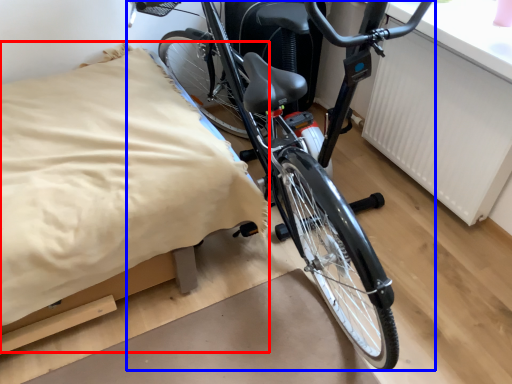
Question: Among these objects, which one is farthest to the camera, sheet (highlighted by a red box) or bicycle (highlighted by a blue box)?

Choices:
 (A) sheet
 (B) bicycle

Answer: (A)